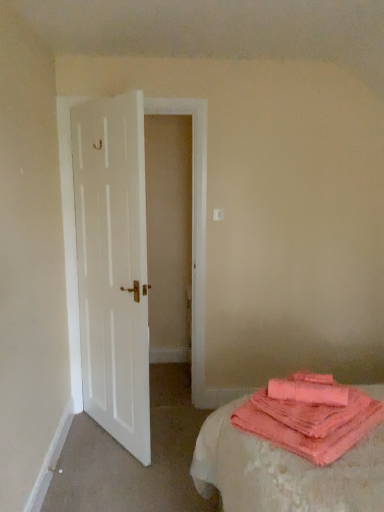
You are a GUI agent. You are given a task and a screenshot of the screen. Output one action in this format:
    pyautogui.click(x=<x>, y=<y>)
    Task: Click on the coral terry cloth at lower right
    This screenshot has width=384, height=512.
    Given the screenshot: What is the action you would take?
    pyautogui.click(x=309, y=424)

Where is `cloth below the coral soft towel at lower right (from the image's perspective)`? This screenshot has height=512, width=384. cloth below the coral soft towel at lower right (from the image's perspective) is located at coordinates (309, 424).

From the picture: Could you tell me if coral terry cloth at lower right is facing coral soft towel at lower right?

No, coral terry cloth at lower right is not oriented towards coral soft towel at lower right.

Can you confirm if coral terry cloth at lower right is thinner than coral soft towel at lower right?

Incorrect, the width of coral terry cloth at lower right is not less than that of coral soft towel at lower right.

From the image's perspective, is coral soft towel at lower right below white wooden door at left?

Yes.

Is coral soft towel at lower right shorter than white wooden door at left?

Yes.

Find the location of a particular element. beach towel that appears below the white wooden door at left (from the image's perspective) is located at coordinates (309, 391).

How many degrees apart are the facing directions of coral soft towel at lower right and white wooden door at left?

There is a 129-degree angle between the facing directions of coral soft towel at lower right and white wooden door at left.

Is point (103, 280) in front of point (332, 422)?

No, (103, 280) is further to viewer.

Identify the location of cloth below the white wooden door at left (from the image's perspective). Image resolution: width=384 pixels, height=512 pixels. (309, 424).

From a real-world perspective, is white wooden door at left under coral terry cloth at lower right?

No.

Is the depth of white wooden door at left greater than that of coral terry cloth at lower right?

Yes, white wooden door at left is further from the camera.

From the image's perspective, is coral soft towel at lower right located beneath coral terry cloth at lower right?

Actually, coral soft towel at lower right appears above coral terry cloth at lower right in the image.

Is coral soft towel at lower right aimed at coral terry cloth at lower right?

No, coral soft towel at lower right is not aimed at coral terry cloth at lower right.

In order to click on cloth that is below the coral soft towel at lower right (from the image's perspective) in this screenshot , I will do `click(309, 424)`.

What's the angular difference between coral soft towel at lower right and coral terry cloth at lower right's facing directions?

The facing directions of coral soft towel at lower right and coral terry cloth at lower right are 35.2 degrees apart.

Is white wooden door at left shorter than coral soft towel at lower right?

No, white wooden door at left is not shorter than coral soft towel at lower right.

Is white wooden door at left to the right of coral soft towel at lower right from the viewer's perspective?

No, white wooden door at left is not to the right of coral soft towel at lower right.

In the image, is white wooden door at left positioned in front of or behind coral soft towel at lower right?

white wooden door at left is positioned farther from the viewer than coral soft towel at lower right.

Considering the sizes of objects white wooden door at left and coral soft towel at lower right in the image provided, who is wider, white wooden door at left or coral soft towel at lower right?

coral soft towel at lower right is wider.

Is coral terry cloth at lower right directly adjacent to white wooden door at left?

No, coral terry cloth at lower right is not next to white wooden door at left.

From the image's perspective, is coral terry cloth at lower right located beneath white wooden door at left?

Yes, from the image's perspective, coral terry cloth at lower right is beneath white wooden door at left.

Who is smaller, coral terry cloth at lower right or white wooden door at left?

coral terry cloth at lower right.

From a real-world perspective, is coral terry cloth at lower right on white wooden door at left?

Incorrect, from a real-world perspective, coral terry cloth at lower right is lower than white wooden door at left.

In order to click on cloth below the coral soft towel at lower right (from the image's perspective) in this screenshot , I will do `click(309, 424)`.

At what (x,y) coordinates should I click in order to perform the action: click on door on the left of coral soft towel at lower right. Please return your answer as a coordinate pair (x, y). This screenshot has height=512, width=384. Looking at the image, I should click on (125, 255).

Estimate the real-world distances between objects in this image. Which object is closer to coral soft towel at lower right, white wooden door at left or coral terry cloth at lower right?

The object closer to coral soft towel at lower right is coral terry cloth at lower right.

Which object lies further to the anchor point coral terry cloth at lower right, coral soft towel at lower right or white wooden door at left?

white wooden door at left.

From the image, which object appears to be nearer to coral terry cloth at lower right, white wooden door at left or coral soft towel at lower right?

coral soft towel at lower right lies closer to coral terry cloth at lower right than the other object.

From the image, which object appears to be nearer to coral soft towel at lower right, coral terry cloth at lower right or white wooden door at left?

coral terry cloth at lower right is positioned closer to the anchor coral soft towel at lower right.

Considering their positions, is coral terry cloth at lower right positioned closer to white wooden door at left than coral soft towel at lower right?

Based on the image, coral terry cloth at lower right appears to be nearer to white wooden door at left.

Considering their positions, is coral soft towel at lower right positioned further to white wooden door at left than coral terry cloth at lower right?

coral soft towel at lower right lies further to white wooden door at left than the other object.

The image size is (384, 512). What are the coordinates of `beach towel between white wooden door at left and coral terry cloth at lower right from left to right` in the screenshot? It's located at (309, 391).